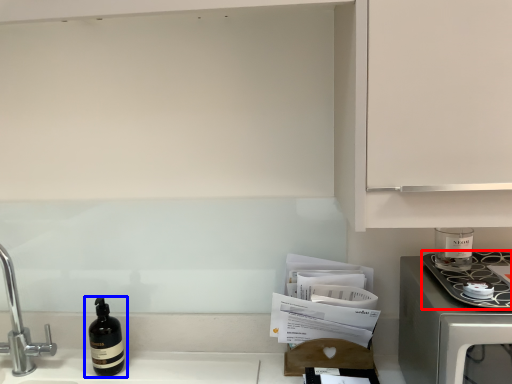
Question: Which of the following is the farthest to the observer, kitchen appliance (highlighted by a red box) or bottle (highlighted by a blue box)?

Choices:
 (A) kitchen appliance
 (B) bottle

Answer: (B)